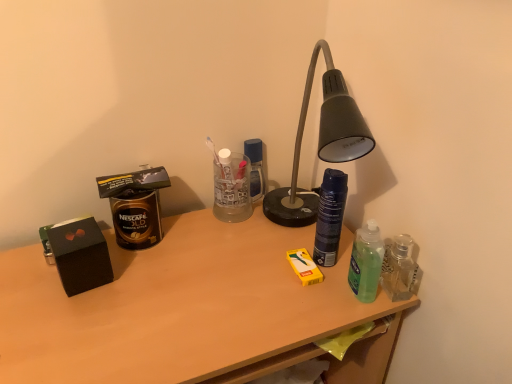
Where is `free spot above wooden desk at center (from a real-world perspective)`? The height and width of the screenshot is (384, 512). free spot above wooden desk at center (from a real-world perspective) is located at coordinates 196,277.